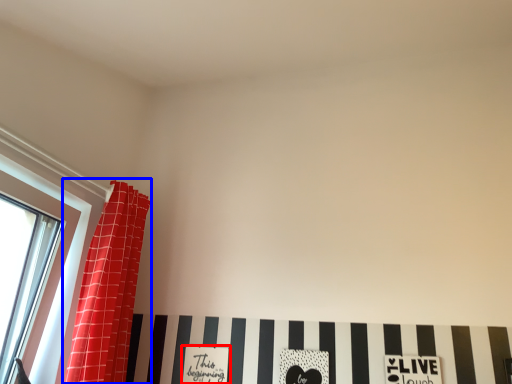
Question: Among these objects, which one is nearest to the camera, print (highlighted by a red box) or curtain (highlighted by a blue box)?

Choices:
 (A) print
 (B) curtain

Answer: (B)